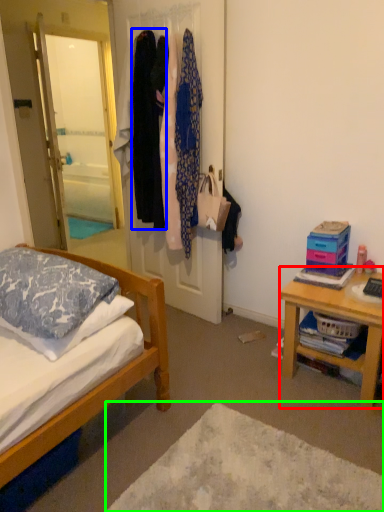
Question: Based on their relative distances, which object is farther from desk (highlighted by a red box)? Choose from clothing (highlighted by a blue box) and plain (highlighted by a green box).

Choices:
 (A) clothing
 (B) plain

Answer: (A)